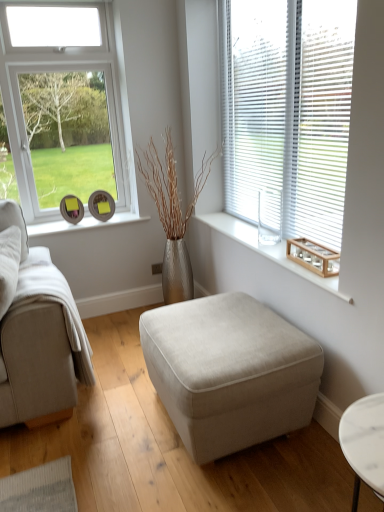
The image size is (384, 512). Find the location of `free space above beige fabric ottoman at center (from a real-world perspective)`. free space above beige fabric ottoman at center (from a real-world perspective) is located at coordinates (215, 328).